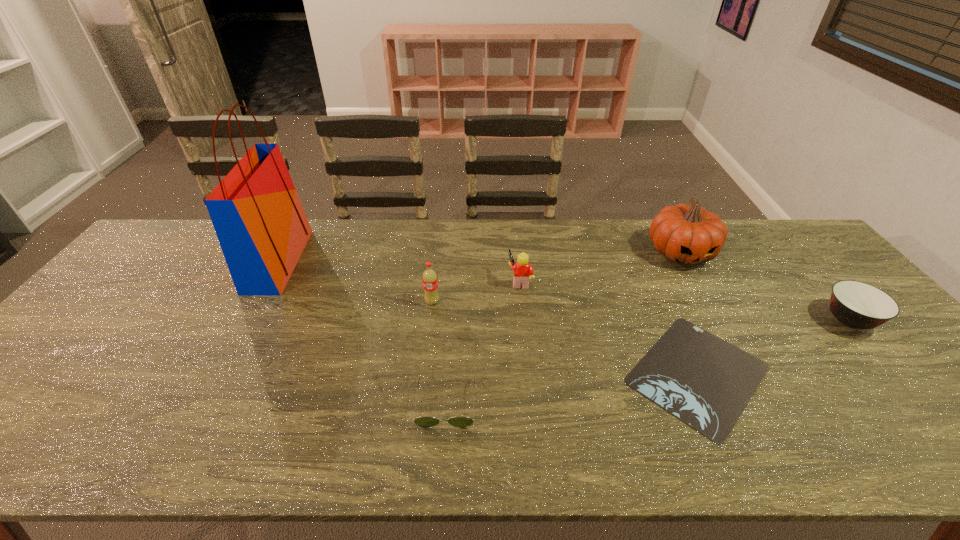
Locate an element on the screen. The width and height of the screenshot is (960, 540). pumpkin at the far edge is located at coordinates (687, 234).

The width and height of the screenshot is (960, 540). Identify the location of sunglasses that is positioned at the near edge. (424, 422).

The height and width of the screenshot is (540, 960). I want to click on mousepad that is at the near edge, so click(x=702, y=380).

This screenshot has height=540, width=960. Identify the location of object present at the right edge. click(857, 305).

In the image, there is a desktop. Identify the location of vacant space at the far edge. (521, 246).

Locate an element on the screen. Image resolution: width=960 pixels, height=540 pixels. blank space at the near edge of the desktop is located at coordinates (732, 451).

The width and height of the screenshot is (960, 540). I want to click on free point at the left edge, so click(x=33, y=390).

In order to click on vacant space at the right edge of the desktop in this screenshot , I will do `click(790, 268)`.

Where is `free spot at the far left corner of the desktop`? Image resolution: width=960 pixels, height=540 pixels. free spot at the far left corner of the desktop is located at coordinates (166, 230).

Image resolution: width=960 pixels, height=540 pixels. I want to click on free space at the far right corner of the desktop, so click(x=786, y=244).